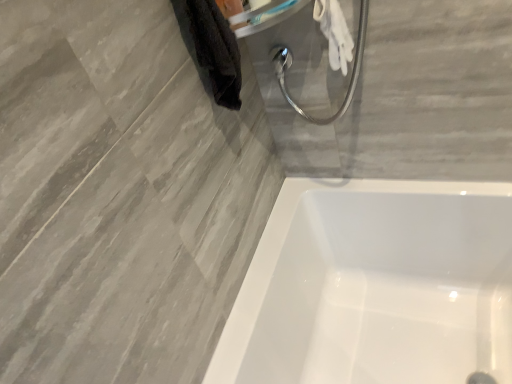
The width and height of the screenshot is (512, 384). Find the location of `black fuzzy towel at upper left`. black fuzzy towel at upper left is located at coordinates [x=212, y=48].

What do you see at coordinates (212, 48) in the screenshot?
I see `black fuzzy towel at upper left` at bounding box center [212, 48].

Where is `black fuzzy towel at upper left`? Image resolution: width=512 pixels, height=384 pixels. black fuzzy towel at upper left is located at coordinates (212, 48).